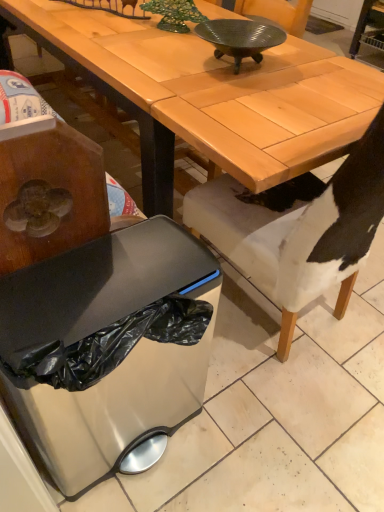
The height and width of the screenshot is (512, 384). What are the coordinates of `vacant area that is situated to the right of metallic ribbed bowl at center` in the screenshot? It's located at (313, 73).